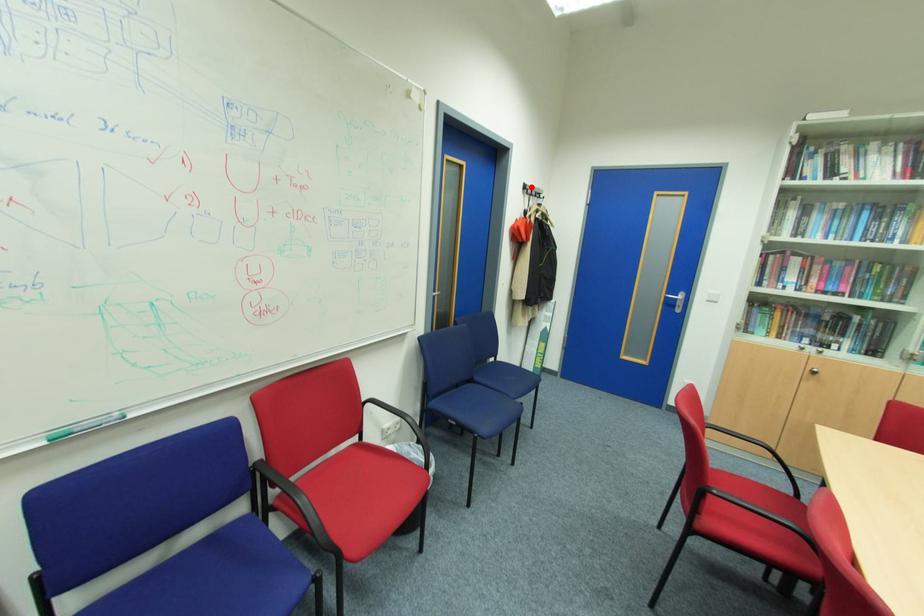
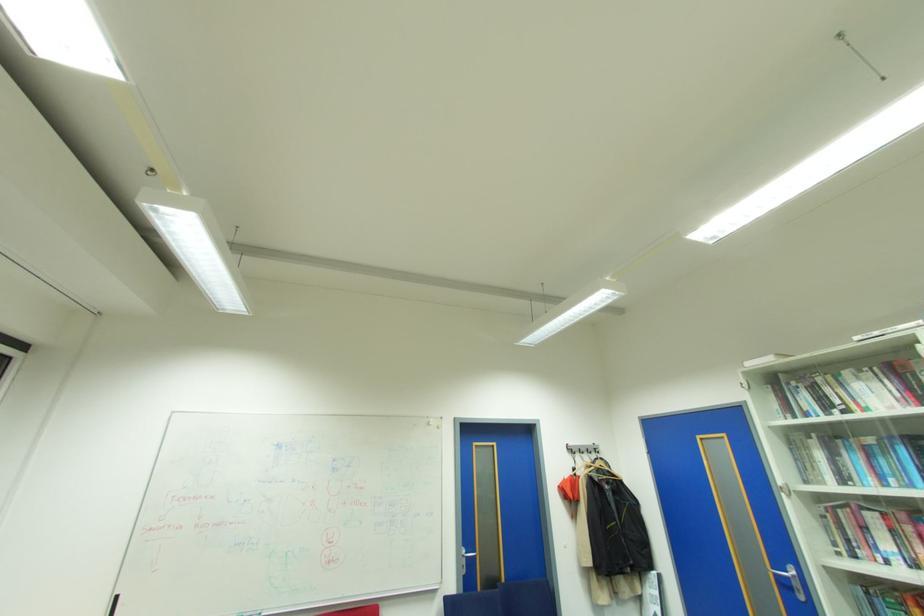
Question: I am providing you with two images of the same scene from different viewpoints. A red point is shown in image1. For the corresponding object point in image2, is it positioned nearer or farther from the camera?

Choices:
 (A) Nearer
 (B) Farther

Answer: (B)